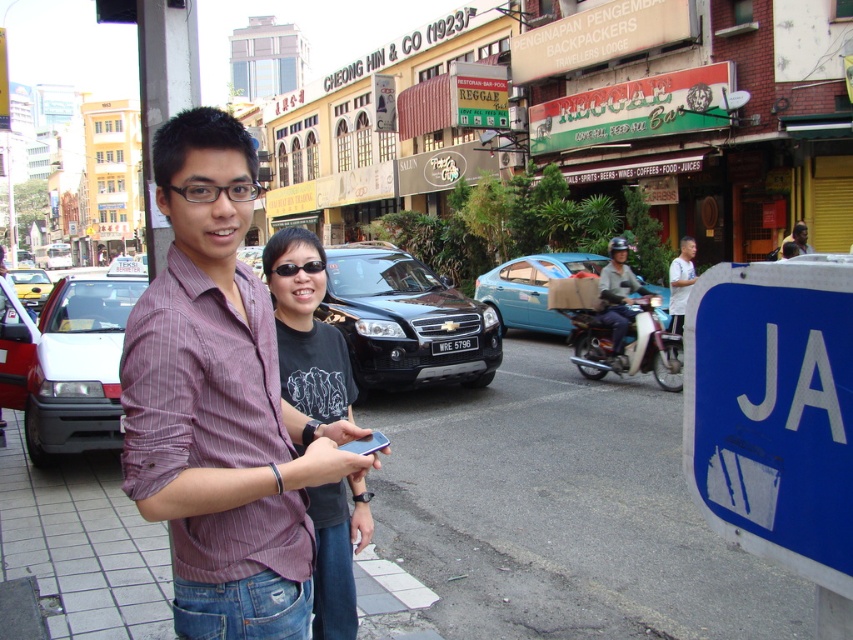
Question: Among these objects, which one is farthest from the camera?

Choices:
 (A) yellow matte taxi at left
 (B) striped cotton shirt at center
 (C) metallic silver motorcycle at center-right

Answer: (A)

Question: Is black matte suv at center bigger than yellow matte taxi at left?

Choices:
 (A) no
 (B) yes

Answer: (A)

Question: Among these points, which one is farthest from the camera?

Choices:
 (A) tap(520, 294)
 (B) tap(669, 272)

Answer: (A)

Question: Where is black matte suv at center located in relation to dark gray helmeted man on motorcycle at center in the image?

Choices:
 (A) below
 (B) above

Answer: (A)

Question: From the image, what is the correct spatial relationship of blue plastic sign at lower right in relation to black matte shirt at center?

Choices:
 (A) below
 (B) above

Answer: (B)

Question: Which of the following is the closest to the observer?

Choices:
 (A) (300, 326)
 (B) (30, 353)
 (C) (621, 280)
 (D) (194, 228)

Answer: (D)